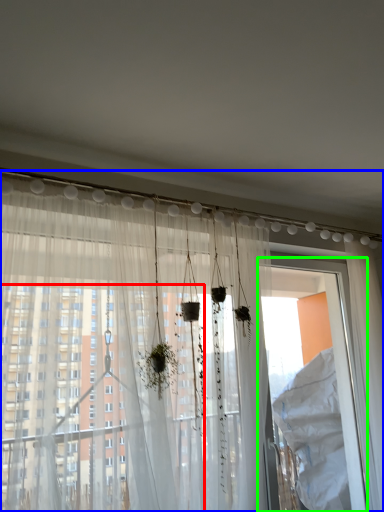
Question: Which object is the farthest from window (highlighted by a red box)? Choose among these: curtain (highlighted by a blue box) or screen door (highlighted by a green box).

Choices:
 (A) curtain
 (B) screen door

Answer: (B)